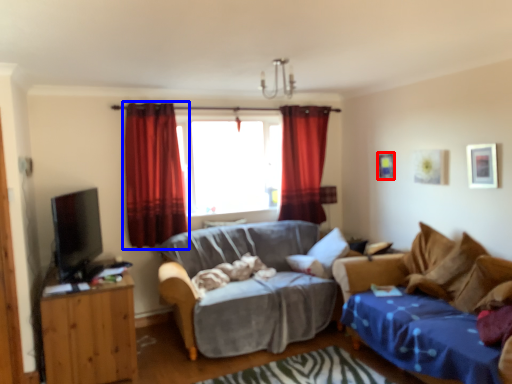
Question: Which of the following is the closest to the observer, picture frame (highlighted by a red box) or curtain (highlighted by a blue box)?

Choices:
 (A) picture frame
 (B) curtain

Answer: (B)